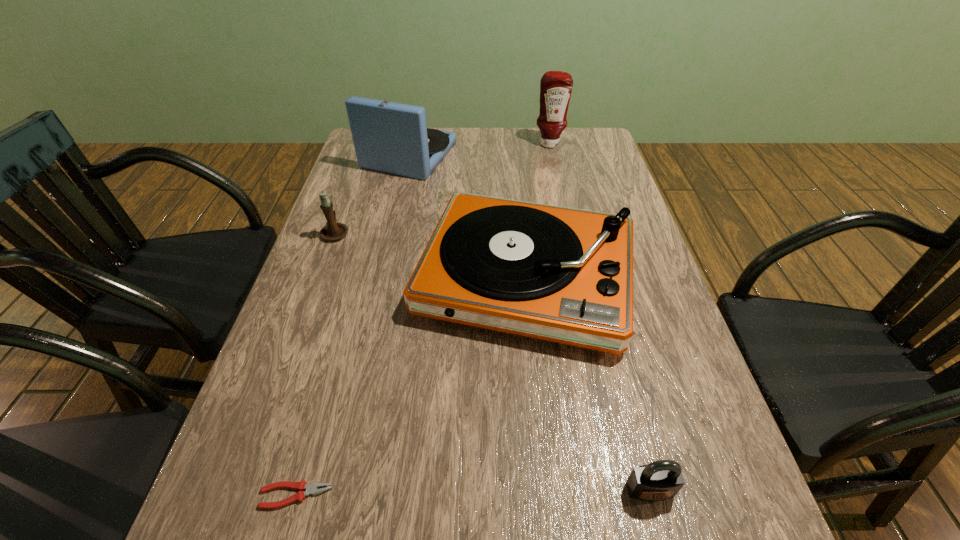
Find the location of a particular element. This screenshot has height=540, width=960. condiment is located at coordinates (556, 86).

You are a GUI agent. You are given a task and a screenshot of the screen. Output one action in this format:
    pyautogui.click(x=<x>, y=<y>)
    Task: Click on the phonograph record
    The image size is (960, 540).
    Given the screenshot: What is the action you would take?
    pyautogui.click(x=389, y=137)

The image size is (960, 540). What are the coordinates of `candle holder` in the screenshot? It's located at (332, 231).

Identify the location of record player. The image size is (960, 540). (565, 275).

I want to click on the fifth tallest object, so click(x=660, y=480).

I want to click on the shortest object, so click(310, 489).

Identify the location of free space located 0.330m on the left of the condiment. This screenshot has height=540, width=960. (438, 144).

You are a GUI agent. You are given a task and a screenshot of the screen. Output one action in this format:
    pyautogui.click(x=<x>, y=<y>)
    Task: Click on the vacant region located on the right of the phonograph record
    The width and height of the screenshot is (960, 540).
    Given the screenshot: What is the action you would take?
    pyautogui.click(x=470, y=155)

Locate an element on the screen. The image size is (960, 540). vacant region located 0.090m on the side of the candle holder with the handle is located at coordinates (347, 202).

Find the location of a particular element. The image size is (960, 540). free spot located on the side of the candle holder with the handle is located at coordinates (350, 190).